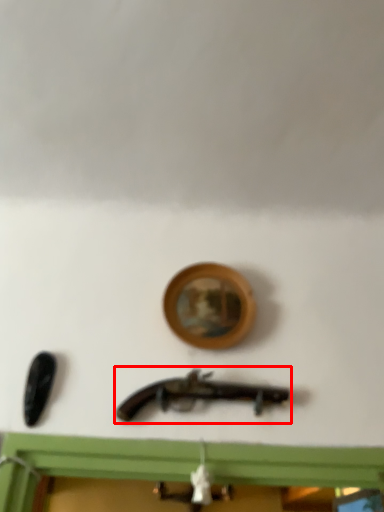
Question: From the image's perspective, what is the correct spatial relationship of weapon (annotated by the red box) in relation to picture frame?

Choices:
 (A) above
 (B) below

Answer: (B)